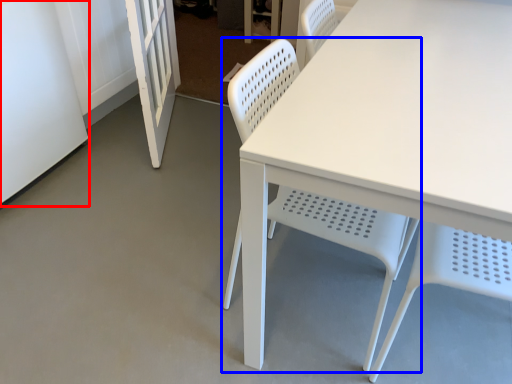
Question: Among these objects, which one is nearest to the camera, screen door (highlighted by a red box) or chair (highlighted by a blue box)?

Choices:
 (A) screen door
 (B) chair

Answer: (B)